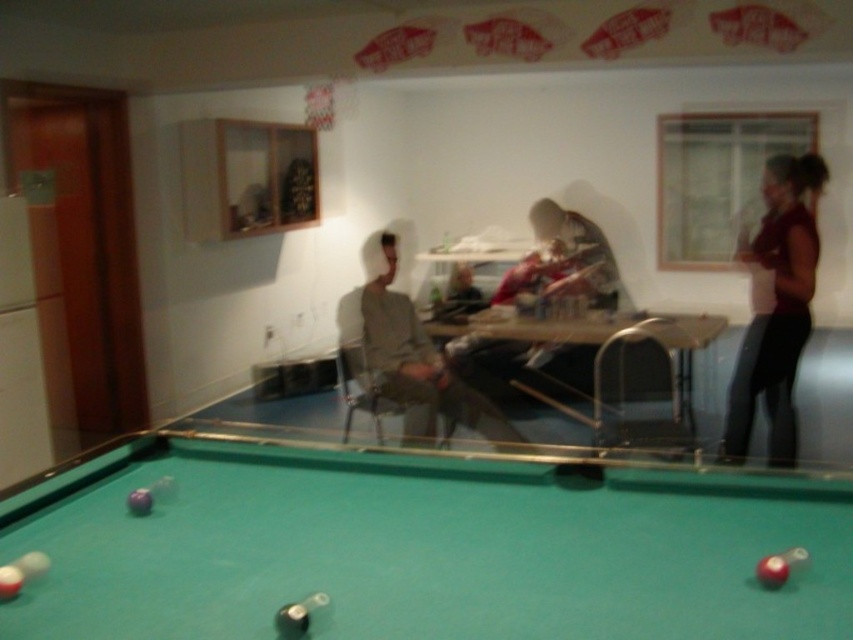
Question: Which point is closer to the camera taking this photo?

Choices:
 (A) (770, 416)
 (B) (173, 625)

Answer: (B)

Question: Which object appears farthest from the camera in this image?

Choices:
 (A) green felt billiard table at lower center
 (B) dark red fabric at right

Answer: (B)

Question: Is green felt billiard table at lower center bigger than dark red fabric at right?

Choices:
 (A) yes
 (B) no

Answer: (A)

Question: In this image, where is green felt billiard table at lower center located relative to dark red fabric at right?

Choices:
 (A) left
 (B) right

Answer: (A)

Question: Which object appears farthest from the camera in this image?

Choices:
 (A) dark red fabric at right
 (B) green felt billiard table at lower center

Answer: (A)

Question: Is green felt billiard table at lower center wider than dark red fabric at right?

Choices:
 (A) no
 (B) yes

Answer: (B)